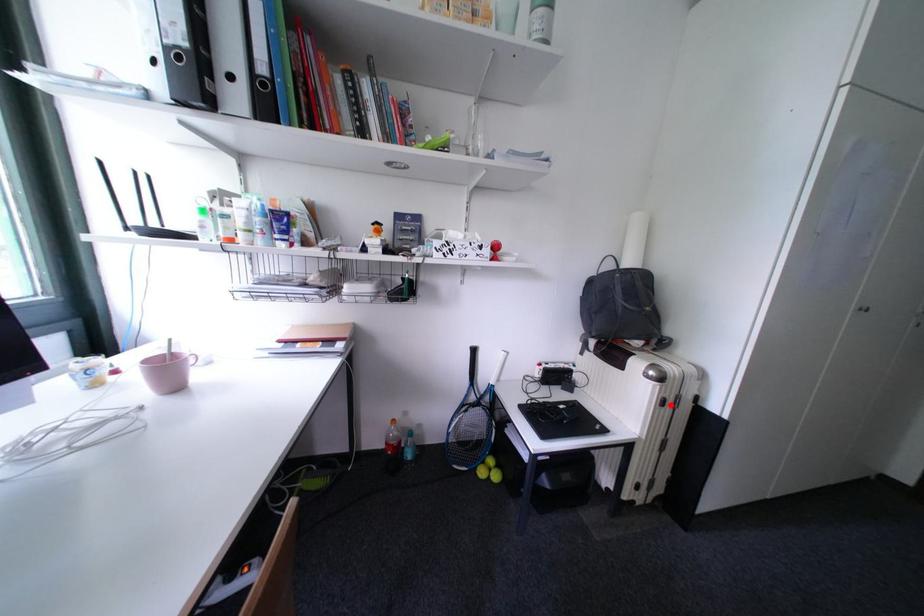
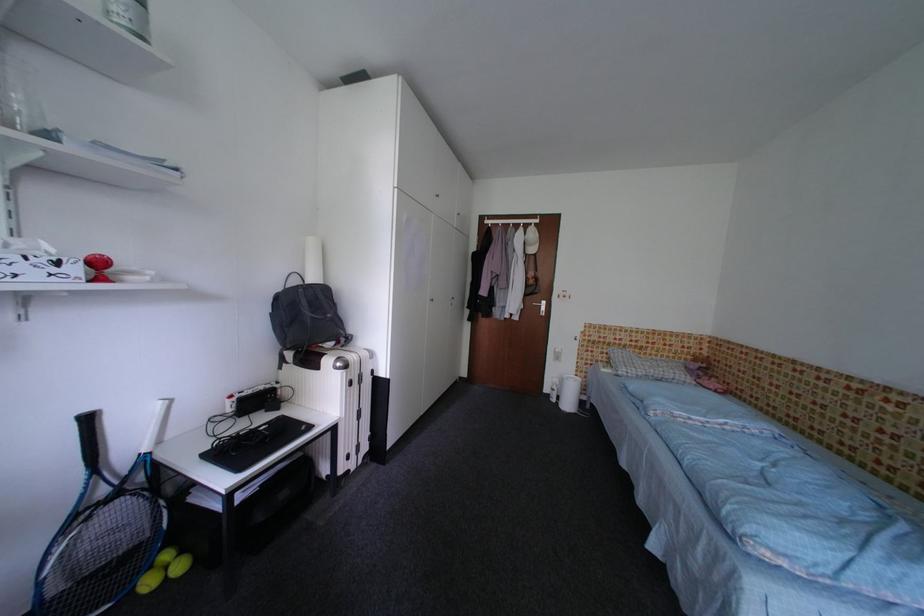
Where in the second image is the point corresponding to the highlighted location from the first image?

(359, 386)